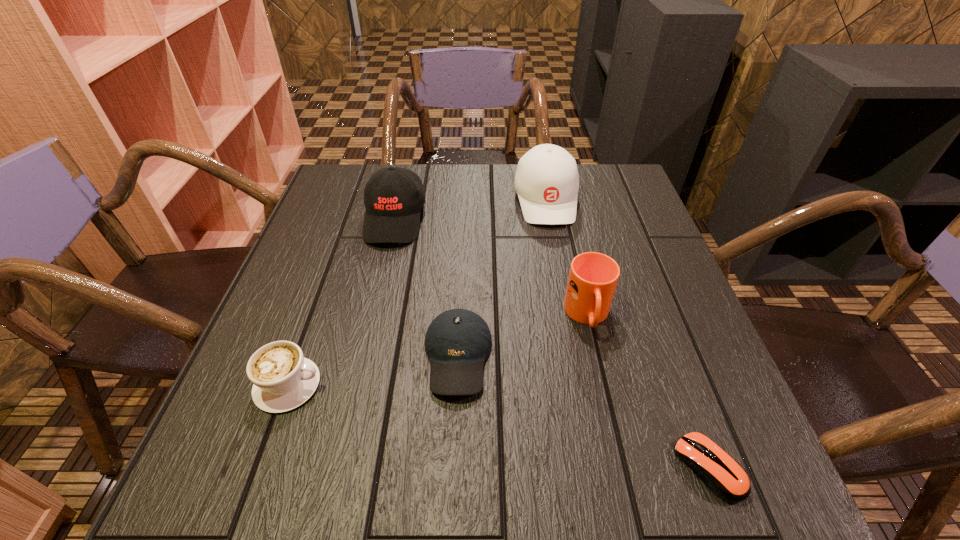
The width and height of the screenshot is (960, 540). I want to click on free space between the shortest baseball cap and the rightmost baseball cap, so click(x=502, y=278).

Image resolution: width=960 pixels, height=540 pixels. I want to click on empty space between the shortest baseball cap and the mug, so click(x=523, y=336).

Locate an element on the screen. Image resolution: width=960 pixels, height=540 pixels. vacant area that lies between the rightmost baseball cap and the shortest object is located at coordinates (627, 333).

Locate an element on the screen. vacant area that lies between the shortest object and the cappuccino is located at coordinates (498, 426).

At what (x,y) coordinates should I click in order to perform the action: click on vacant space that is in between the rightmost baseball cap and the cappuccino. Please return your answer as a coordinate pair (x, y). Image resolution: width=960 pixels, height=540 pixels. Looking at the image, I should click on (418, 292).

Image resolution: width=960 pixels, height=540 pixels. I want to click on free space between the leftmost baseball cap and the cappuccino, so click(342, 302).

The height and width of the screenshot is (540, 960). What are the coordinates of `object that is the fourth closest one to the rightmost baseball cap` in the screenshot? It's located at (282, 378).

Find the location of a particular element. The height and width of the screenshot is (540, 960). object that is the closest to the third object from left to right is located at coordinates 593,277.

I want to click on the closest baseball cap relative to the mug, so click(x=458, y=341).

Locate an element on the screen. baseball cap that can be found as the third closest to the mug is located at coordinates click(x=393, y=197).